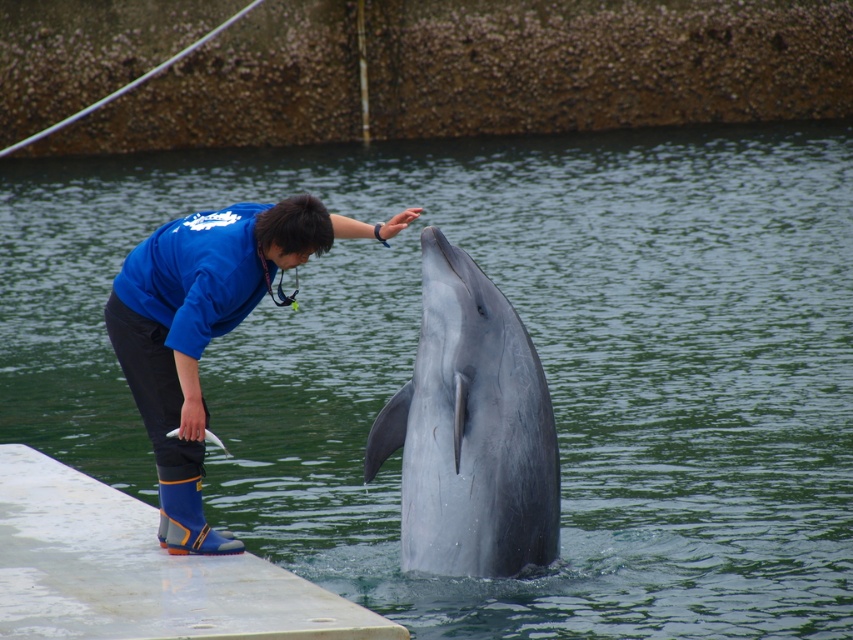
Between white concrete dock at lower left and blue fleece jacket at center, which one is positioned lower?

white concrete dock at lower left is below.

Which is more to the right, white concrete dock at lower left or blue fleece jacket at center?

blue fleece jacket at center is more to the right.

Locate an element on the screen. white concrete dock at lower left is located at coordinates (138, 570).

Image resolution: width=853 pixels, height=640 pixels. Identify the location of white concrete dock at lower left. (138, 570).

Between point (474, 316) and point (181, 388), which one is positioned behind?

The point (181, 388) is more distant.

Is gray smooth dolphin at center smaller than blue fleece jacket at center?

No, gray smooth dolphin at center is not smaller than blue fleece jacket at center.

Locate an element on the screen. The width and height of the screenshot is (853, 640). gray smooth dolphin at center is located at coordinates (469, 429).

The width and height of the screenshot is (853, 640). I want to click on gray smooth dolphin at center, so click(x=469, y=429).

The width and height of the screenshot is (853, 640). Describe the element at coordinates (469, 429) in the screenshot. I see `gray smooth dolphin at center` at that location.

Is point (480, 406) more distant than point (90, 620)?

That is True.

Image resolution: width=853 pixels, height=640 pixels. Find the location of `gray smooth dolphin at center`. gray smooth dolphin at center is located at coordinates (469, 429).